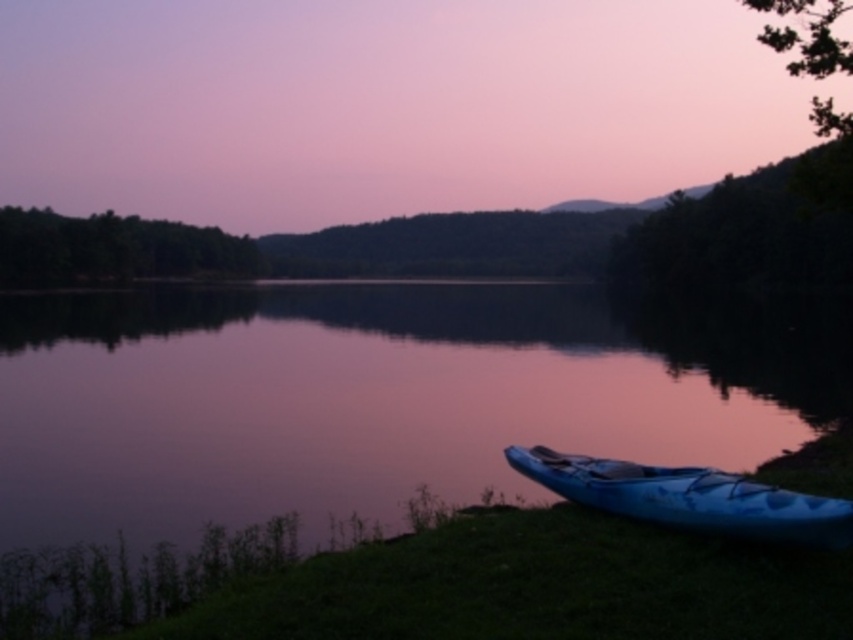
Does point (112, 483) come closer to viewer compared to point (556, 460)?

No.

From the picture: Is smooth water at lake center taller than blue glossy kayak at lower right?

Yes.

Is point (474, 484) positioned before point (752, 497)?

That is False.

The height and width of the screenshot is (640, 853). I want to click on smooth water at lake center, so click(x=376, y=396).